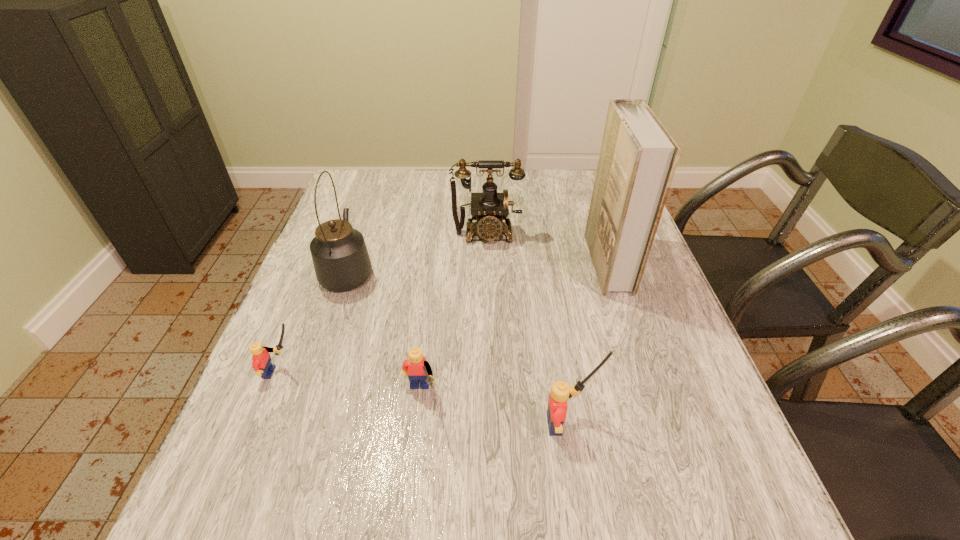
This screenshot has width=960, height=540. What are the coordinates of `vacant space situated 0.390m on the front-facing side of the leftmost Lego` in the screenshot? It's located at (489, 372).

The height and width of the screenshot is (540, 960). Identify the location of vacant space located on the front-facing side of the fifth tallest object. (413, 453).

The image size is (960, 540). Identify the location of free space located 0.220m on the front-facing side of the second object from right to left. (717, 424).

You are a GUI agent. You are given a task and a screenshot of the screen. Output one action in this format:
    pyautogui.click(x=<x>, y=<y>)
    Task: Click on the free space located on the cover of the tallest object
    This screenshot has width=960, height=540.
    Given the screenshot: What is the action you would take?
    pyautogui.click(x=554, y=263)

Find the location of a particular element. The width and height of the screenshot is (960, 540). vacant space located 0.380m on the cover of the tallest object is located at coordinates (447, 263).

The height and width of the screenshot is (540, 960). What are the coordinates of `vacant space located 0.260m on the cover of the tallest object` in the screenshot? It's located at (492, 263).

The image size is (960, 540). I want to click on vacant space located on the rotary dial of the telephone, so click(x=488, y=320).

I want to click on vacant region located spout on the kettle, so click(x=372, y=202).

This screenshot has height=540, width=960. In order to click on free space located 0.380m spout on the kettle in this screenshot , I will do `click(379, 178)`.

Locate an element on the screen. Image resolution: width=960 pixels, height=540 pixels. free location located 0.310m spout on the kettle is located at coordinates (376, 189).